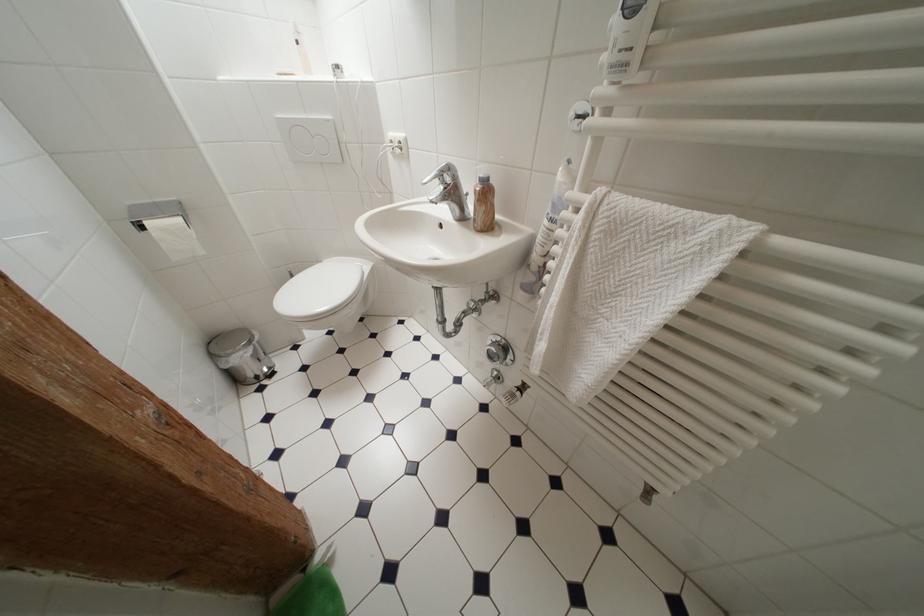
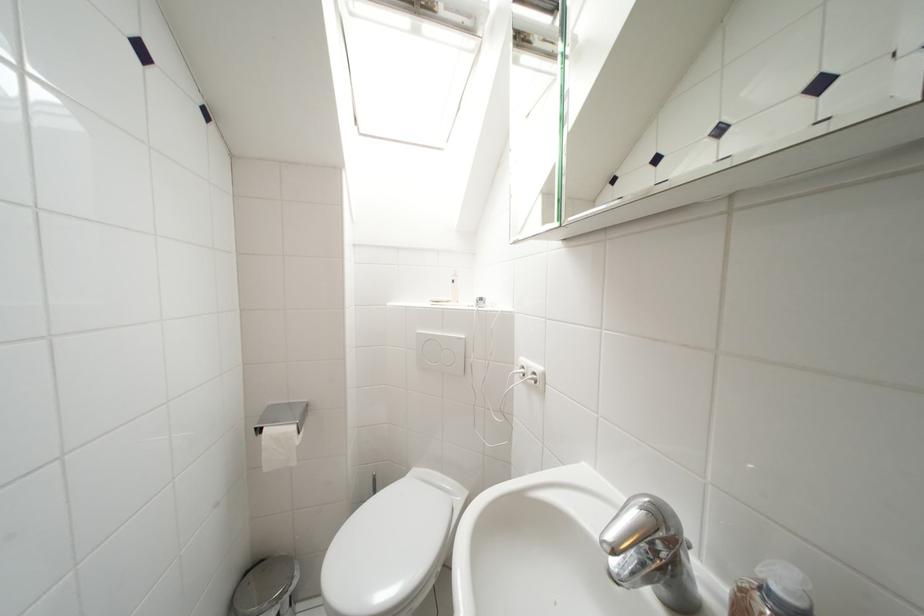
Where in the second image is the point corresponding to point 407,146 from the first image?

(541, 377)